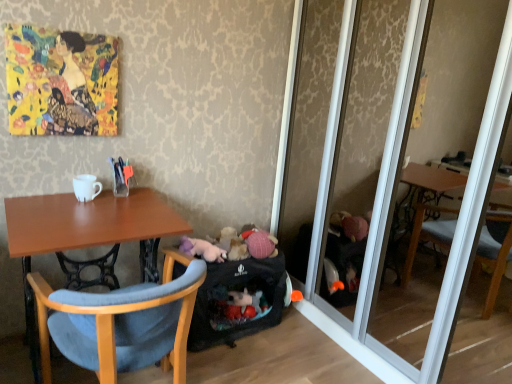
You are a GUI agent. You are given a task and a screenshot of the screen. Output one action in this format:
    pyautogui.click(x=<x>, y=<y>)
    Task: Click on the transparent glass mirror at center
    The image size is (512, 384).
    Given the screenshot: What is the action you would take?
    pyautogui.click(x=452, y=201)

The width and height of the screenshot is (512, 384). I want to click on fluffy plush toys at center, so [231, 244].

This screenshot has height=384, width=512. Identify the location of white glossy mug at upper left. (86, 187).

You are a GUI agent. You are given a task and a screenshot of the screen. Output one action in this format:
    pyautogui.click(x=<x>, y=<y>)
    Task: Click on the fluffy white stuffed animal at lower center
    The width and height of the screenshot is (512, 384).
    Given the screenshot: What is the action you would take?
    pyautogui.click(x=202, y=249)

Considering the relative sizes of fluffy plush toys at center and black fabric baby carriage at lower center in the image provided, is fluffy plush toys at center bigger than black fabric baby carriage at lower center?

No.

Is fluffy plush toys at center not close to black fabric baby carriage at lower center?

fluffy plush toys at center is actually quite close to black fabric baby carriage at lower center.

What's the angular difference between fluffy plush toys at center and black fabric baby carriage at lower center's facing directions?

The facing directions of fluffy plush toys at center and black fabric baby carriage at lower center are 0.000682 degrees apart.

Which is behind, fluffy plush toys at center or black fabric baby carriage at lower center?

fluffy plush toys at center.

You are a GUI agent. You are given a task and a screenshot of the screen. Output one action in this format:
    pyautogui.click(x=<x>, y=<y>)
    Task: Click on the mirror above the fluffy plush toys at center (from the image's perspective)
    This screenshot has width=512, height=384.
    Given the screenshot: What is the action you would take?
    pyautogui.click(x=452, y=201)

Is transparent glass mirror at center at the left side of fluffy plush toys at center?

Incorrect, transparent glass mirror at center is not on the left side of fluffy plush toys at center.

Considering the relative sizes of transparent glass mirror at center and fluffy plush toys at center in the image provided, is transparent glass mirror at center taller than fluffy plush toys at center?

Correct, transparent glass mirror at center is much taller as fluffy plush toys at center.

Can you confirm if white glossy mug at upper left is shorter than fluffy white stuffed animal at lower center?

No, white glossy mug at upper left is not shorter than fluffy white stuffed animal at lower center.

Measure the distance from white glossy mug at upper left to fluffy white stuffed animal at lower center.

white glossy mug at upper left and fluffy white stuffed animal at lower center are 22.55 inches apart from each other.

Is white glossy mug at upper left positioned far away from fluffy white stuffed animal at lower center?

No, white glossy mug at upper left is not far away from fluffy white stuffed animal at lower center.

Does white glossy mug at upper left contain fluffy white stuffed animal at lower center?

No, fluffy white stuffed animal at lower center is not a part of white glossy mug at upper left.

Which of these two, white glossy mug at upper left or transparent glass mirror at center, stands shorter?

white glossy mug at upper left is shorter.

Is white glossy mug at upper left oriented towards transparent glass mirror at center?

No, white glossy mug at upper left is not aimed at transparent glass mirror at center.

Would you say white glossy mug at upper left is a long distance from transparent glass mirror at center?

Yes, white glossy mug at upper left is far from transparent glass mirror at center.

In the scene shown: Is light blue fabric chair at lower left spatially inside fluffy white stuffed animal at lower center, or outside of it?

light blue fabric chair at lower left is located beyond the bounds of fluffy white stuffed animal at lower center.

Can you confirm if light blue fabric chair at lower left is wider than fluffy white stuffed animal at lower center?

Yes, light blue fabric chair at lower left is wider than fluffy white stuffed animal at lower center.

Could you tell me if light blue fabric chair at lower left is facing fluffy white stuffed animal at lower center?

No, light blue fabric chair at lower left is not aimed at fluffy white stuffed animal at lower center.

Considering the relative sizes of light blue fabric chair at lower left and fluffy white stuffed animal at lower center in the image provided, is light blue fabric chair at lower left smaller than fluffy white stuffed animal at lower center?

Incorrect, light blue fabric chair at lower left is not smaller in size than fluffy white stuffed animal at lower center.

Based on their sizes in the image, would you say gold textured painting at upper left is bigger or smaller than black fabric baby carriage at lower center?

Clearly, gold textured painting at upper left is smaller in size than black fabric baby carriage at lower center.

Could you tell me if gold textured painting at upper left is facing black fabric baby carriage at lower center?

No, gold textured painting at upper left is not facing towards black fabric baby carriage at lower center.

Is gold textured painting at upper left to the left of black fabric baby carriage at lower center from the viewer's perspective?

Indeed, gold textured painting at upper left is positioned on the left side of black fabric baby carriage at lower center.

The image size is (512, 384). Find the location of `baby carriage that is behind the gold textured painting at upper left`. baby carriage that is behind the gold textured painting at upper left is located at coordinates (241, 291).

Considering the sizes of objects gold textured painting at upper left and fluffy white stuffed animal at lower center in the image provided, who is smaller, gold textured painting at upper left or fluffy white stuffed animal at lower center?

With smaller size is fluffy white stuffed animal at lower center.

Is gold textured painting at upper left not inside fluffy white stuffed animal at lower center?

gold textured painting at upper left is positioned outside fluffy white stuffed animal at lower center.

Is gold textured painting at upper left at the right side of fluffy white stuffed animal at lower center?

No, gold textured painting at upper left is not to the right of fluffy white stuffed animal at lower center.

Does gold textured painting at upper left have a lesser width compared to fluffy white stuffed animal at lower center?

Indeed, gold textured painting at upper left has a lesser width compared to fluffy white stuffed animal at lower center.

This screenshot has width=512, height=384. What are the coordinates of `baby carriage below the fluffy plush toys at center (from a real-world perspective)` in the screenshot? It's located at (241, 291).

Find the location of a particular element. The image size is (512, 384). toy on the left of transparent glass mirror at center is located at coordinates (231, 244).

Estimate the real-world distances between objects in this image. Which object is further from black fabric baby carriage at lower center, transparent glass mirror at center or white glossy mug at upper left?

white glossy mug at upper left.

From the image, which object appears to be farther from transparent glass mirror at center, fluffy plush toys at center or white glossy mug at upper left?

white glossy mug at upper left is further to transparent glass mirror at center.

Which object lies nearer to the anchor point white glossy mug at upper left, black fabric baby carriage at lower center or transparent glass mirror at center?

Based on the image, black fabric baby carriage at lower center appears to be nearer to white glossy mug at upper left.

Based on the photo, based on their spatial positions, is gold textured painting at upper left or light blue fabric chair at lower left further from white glossy mug at upper left?

light blue fabric chair at lower left lies further to white glossy mug at upper left than the other object.

From the image, which object appears to be farther from transparent glass mirror at center, fluffy white stuffed animal at lower center or white glossy mug at upper left?

white glossy mug at upper left is positioned further to the anchor transparent glass mirror at center.

Estimate the real-world distances between objects in this image. Which object is closer to black fabric baby carriage at lower center, fluffy white stuffed animal at lower center or white glossy mug at upper left?

Based on the image, fluffy white stuffed animal at lower center appears to be nearer to black fabric baby carriage at lower center.

From the image, which object appears to be nearer to transparent glass mirror at center, gold textured painting at upper left or light blue fabric chair at lower left?

Among the two, light blue fabric chair at lower left is located nearer to transparent glass mirror at center.

Estimate the real-world distances between objects in this image. Which object is closer to black fabric baby carriage at lower center, fluffy white stuffed animal at lower center or transparent glass mirror at center?

Among the two, fluffy white stuffed animal at lower center is located nearer to black fabric baby carriage at lower center.

Where is `animal between gold textured painting at upper left and light blue fabric chair at lower left in the vertical direction`? This screenshot has height=384, width=512. animal between gold textured painting at upper left and light blue fabric chair at lower left in the vertical direction is located at coordinates (202, 249).

Locate an element on the screen. Image resolution: width=512 pixels, height=384 pixels. toy that lies between gold textured painting at upper left and light blue fabric chair at lower left from top to bottom is located at coordinates (231, 244).

Find the location of `baby carriage between light blue fabric chair at lower left and fluffy white stuffed animal at lower center from front to back`. baby carriage between light blue fabric chair at lower left and fluffy white stuffed animal at lower center from front to back is located at coordinates pos(241,291).

You are a GUI agent. You are given a task and a screenshot of the screen. Output one action in this format:
    pyautogui.click(x=<x>, y=<y>)
    Task: Click on the animal positioned between light blue fabric chair at lower left and fluffy plush toys at center from near to far
    
    Given the screenshot: What is the action you would take?
    pyautogui.click(x=202, y=249)